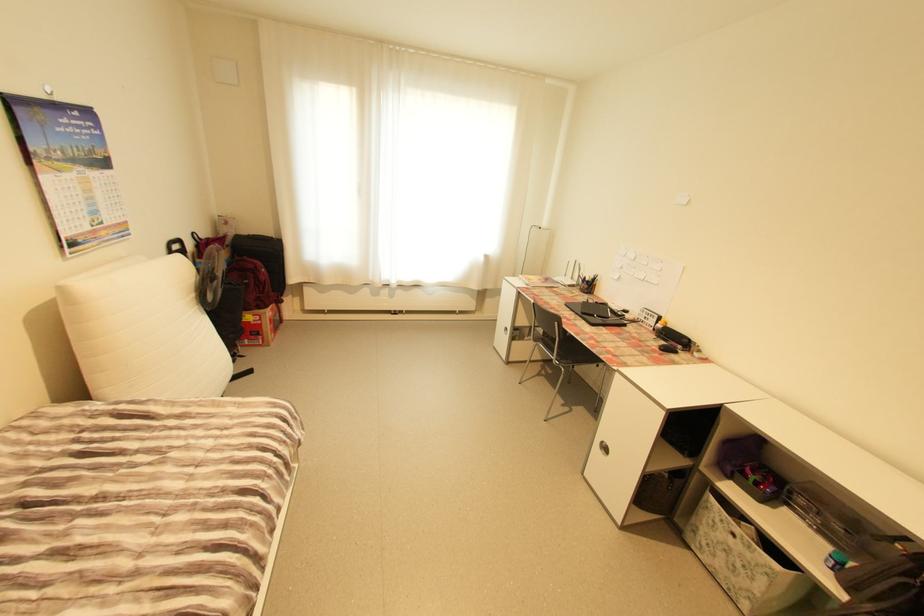
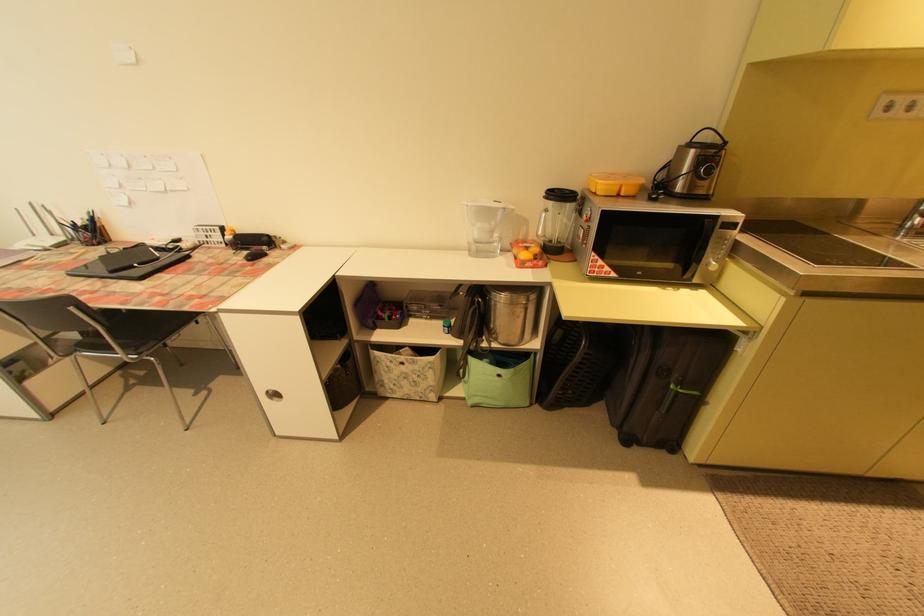
In the second image, find the point that corresponds to point (610, 442) in the first image.

(274, 392)